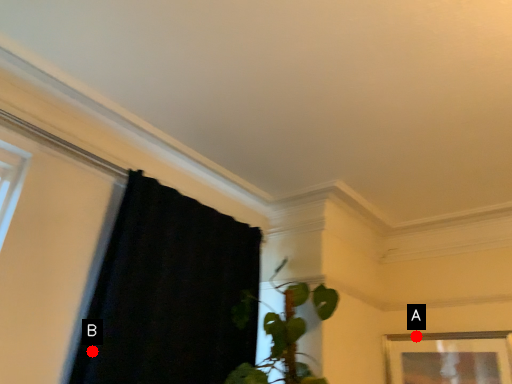
Question: Two points are circled on the image, labeled by A and B beside each circle. Among these points, which one is nearest to the camera?

Choices:
 (A) A is closer
 (B) B is closer

Answer: (B)